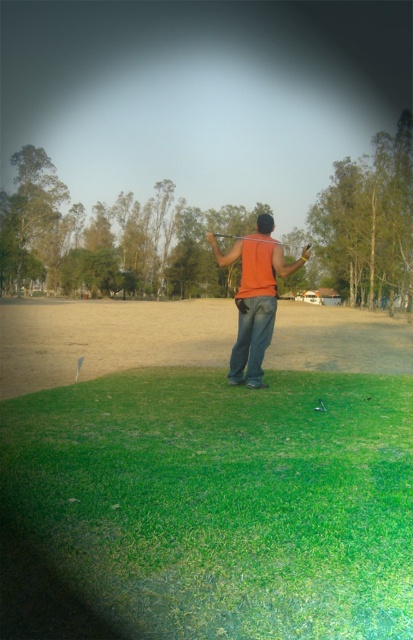
You are a golfer standing on the green grassy field at lower center and want to hit a ball towards the brown sandy dirt field at center. Which direction should you aim your shot?

The green grassy field at lower center is to the right of the brown sandy dirt field at center, so you should aim to the left to hit the ball towards the brown sandy dirt field at center.

You are a golfer standing on the brown sandy dirt field at center and wearing the orange fabric shirt at center. You want to hit a golf ball towards the trees in the background. Which direction should you aim relative to your current position?

The brown sandy dirt field at center is positioned over the orange fabric shirt at center, meaning the shirt is underneath the dirt field. Since the dirt field is in front of you, you should aim towards the trees in the background beyond the sandy dirt field.